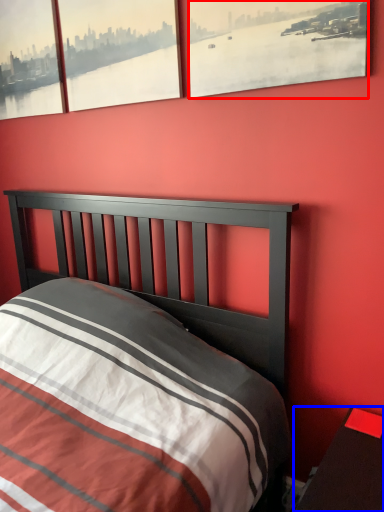
Question: Which of the following is the farthest to the observer, window (highlighted by a red box) or nightstand (highlighted by a blue box)?

Choices:
 (A) window
 (B) nightstand

Answer: (A)